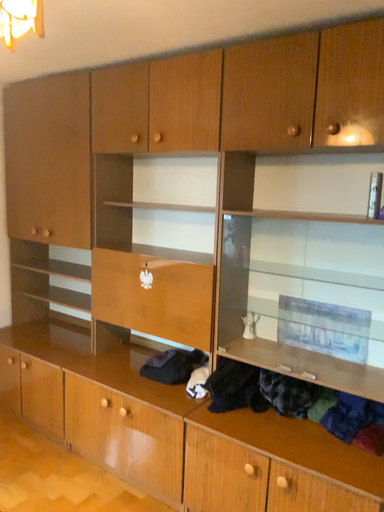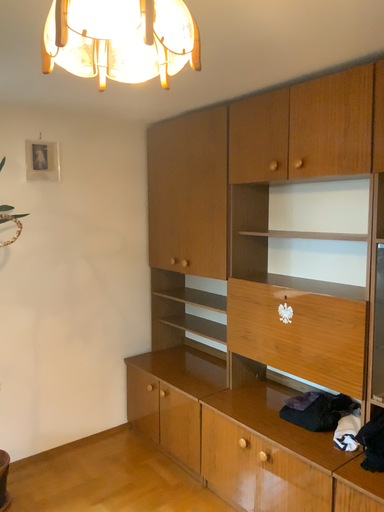
Question: Which way did the camera rotate in the video?

Choices:
 (A) rotated right
 (B) rotated left

Answer: (B)